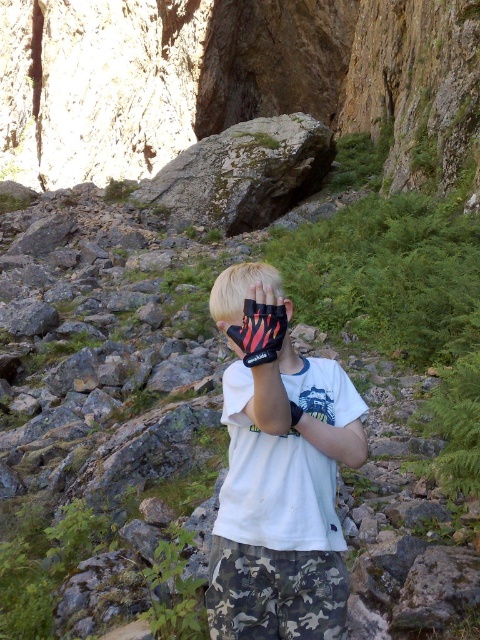
Is white matte shirt at center smaller than green mossy rock at upper center?

Correct, white matte shirt at center occupies less space than green mossy rock at upper center.

The width and height of the screenshot is (480, 640). Identify the location of white matte shirt at center. (278, 474).

Image resolution: width=480 pixels, height=640 pixels. I want to click on white matte shirt at center, so click(278, 474).

Does green mossy rock at upper center have a larger size compared to black mesh glove at center?

Correct, green mossy rock at upper center is larger in size than black mesh glove at center.

Does green mossy rock at upper center appear on the right side of black mesh glove at center?

No, green mossy rock at upper center is not to the right of black mesh glove at center.

Measure the distance between green mossy rock at upper center and camera.

They are 34.63 meters apart.

Locate an element on the screen. The image size is (480, 640). green mossy rock at upper center is located at coordinates (242, 173).

Can you confirm if white matte shirt at center is positioned to the left of black mesh glove at center?

Incorrect, white matte shirt at center is not on the left side of black mesh glove at center.

The image size is (480, 640). Find the location of `white matte shirt at center`. white matte shirt at center is located at coordinates (278, 474).

The image size is (480, 640). In order to click on white matte shirt at center in this screenshot , I will do `click(278, 474)`.